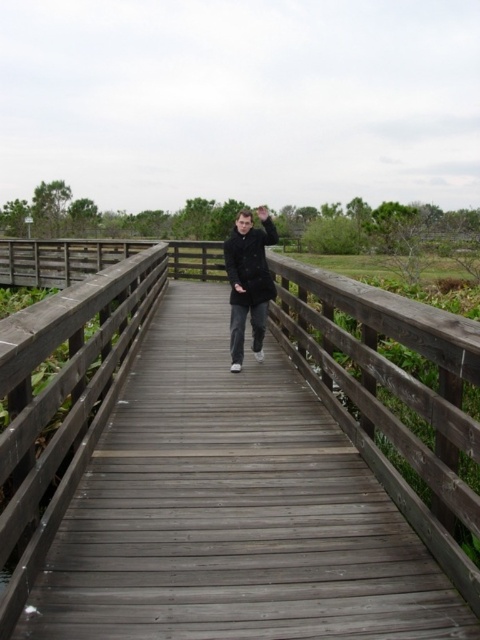
Is wooden bridge at center bigger than matte black coat at center?

Yes, wooden bridge at center is bigger than matte black coat at center.

Which is more to the right, wooden bridge at center or matte black coat at center?

matte black coat at center

Measure the distance between point (430, 529) and camera.

Point (430, 529) and camera are 2.64 meters apart.

Identify the location of wooden bridge at center. (69, 372).